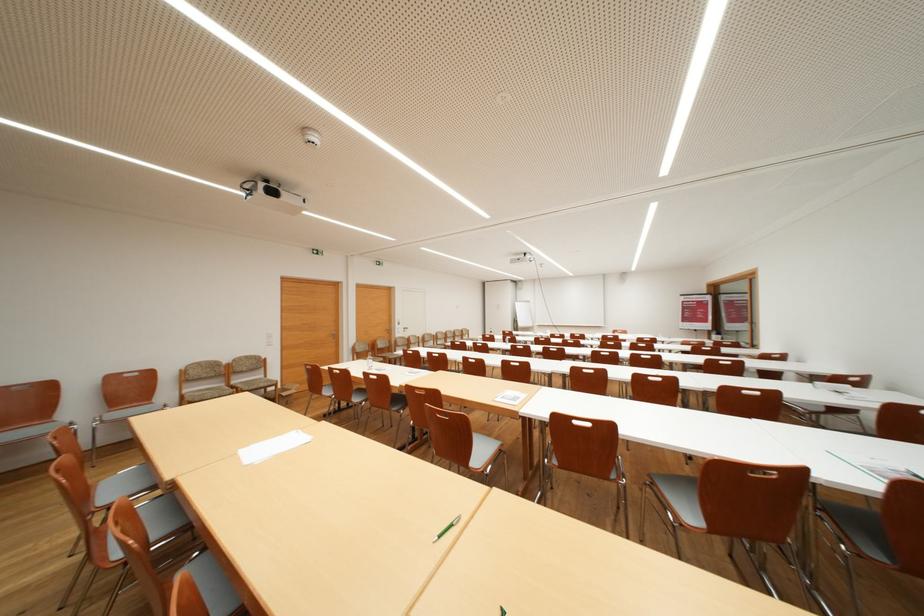
Identify the location of silver door handle. The image size is (924, 616). (405, 330).